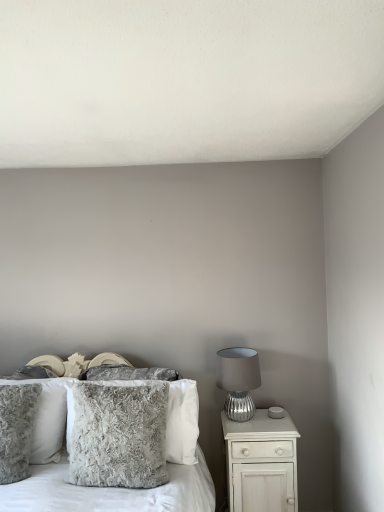
Question: Considering the relative positions of fuzzy gray pillow at center and white glossy nightstand at right in the image provided, is fuzzy gray pillow at center to the left of white glossy nightstand at right from the viewer's perspective?

Choices:
 (A) yes
 (B) no

Answer: (A)

Question: From a real-world perspective, is fuzzy gray pillow at center below white glossy nightstand at right?

Choices:
 (A) no
 (B) yes

Answer: (A)

Question: Is the depth of fuzzy gray pillow at center greater than that of white glossy nightstand at right?

Choices:
 (A) no
 (B) yes

Answer: (A)

Question: Is fuzzy gray pillow at center far away from white glossy nightstand at right?

Choices:
 (A) yes
 (B) no

Answer: (B)

Question: Does fuzzy gray pillow at center have a larger size compared to white glossy nightstand at right?

Choices:
 (A) no
 (B) yes

Answer: (B)

Question: In the image, is fuzzy gray pillow at center, the 4th pillow viewed from the back, positioned in front of or behind fuzzy gray pillow at left, the 3th pillow when ordered from back to front?

Choices:
 (A) behind
 (B) front

Answer: (B)

Question: Looking at their shapes, would you say fuzzy gray pillow at center, which is the first pillow in front-to-back order, is wider or thinner than fuzzy gray pillow at left, positioned as the 2th pillow in front-to-back order?

Choices:
 (A) wide
 (B) thin

Answer: (B)

Question: In terms of height, does fuzzy gray pillow at center, the 4th pillow viewed from the back, look taller or shorter compared to fuzzy gray pillow at left, the 3th pillow when ordered from back to front?

Choices:
 (A) tall
 (B) short

Answer: (B)

Question: From a real-world perspective, relative to fuzzy gray pillow at left, the 3th pillow when ordered from back to front, is fuzzy gray pillow at center, the 4th pillow viewed from the back, vertically above or below?

Choices:
 (A) below
 (B) above

Answer: (B)

Question: In the image, is fuzzy gray pillow at center positioned in front of or behind fluffy gray pillow at left, which ranks as the first pillow in back-to-front order?

Choices:
 (A) front
 (B) behind

Answer: (A)

Question: From a real-world perspective, is fuzzy gray pillow at center positioned above or below fluffy gray pillow at left, which ranks as the first pillow in back-to-front order?

Choices:
 (A) above
 (B) below

Answer: (B)

Question: In terms of size, does fuzzy gray pillow at center appear bigger or smaller than fluffy gray pillow at left, which ranks as the first pillow in back-to-front order?

Choices:
 (A) big
 (B) small

Answer: (A)

Question: Is fuzzy gray pillow at center inside the boundaries of fluffy gray pillow at left, which ranks as the first pillow in back-to-front order, or outside?

Choices:
 (A) outside
 (B) inside

Answer: (A)

Question: Considering the positions of fuzzy gray pillow at center, which is the first pillow in front-to-back order, and fluffy gray pillow at left, positioned as the 4th pillow in front-to-back order, in the image, is fuzzy gray pillow at center, which is the first pillow in front-to-back order, taller or shorter than fluffy gray pillow at left, positioned as the 4th pillow in front-to-back order,?

Choices:
 (A) short
 (B) tall

Answer: (A)

Question: Choose the correct answer: Is fuzzy gray pillow at center, the 4th pillow viewed from the back, inside fluffy gray pillow at left, which ranks as the first pillow in back-to-front order, or outside it?

Choices:
 (A) inside
 (B) outside

Answer: (B)